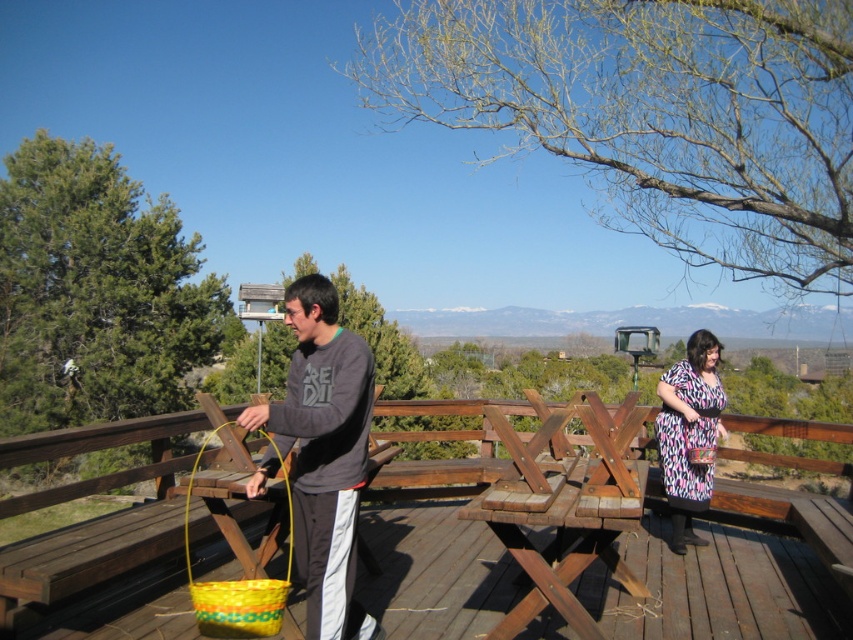
You are planning to place a new decorative item on the wooden deck. The item you have is the size of the printed fabric dress at right. Can the matte yellow basket at center hold this item?

The matte yellow basket at center is larger in size than the printed fabric dress at right, so it can hold the item.

You are planning to set up a small tablecloth on the wooden picnic table at center. The tablecloth is 4 feet long. Will the tablecloth reach the matte yellow basket at center if placed from the edge of the table?

The wooden picnic table at center is 3.68 feet from matte yellow basket at center. Since the tablecloth is 4 feet long, it will extend beyond the edge of the table and reach the matte yellow basket at center.

What are the coordinates of the matte yellow basket at center?

The matte yellow basket at center is located at point (323,454).